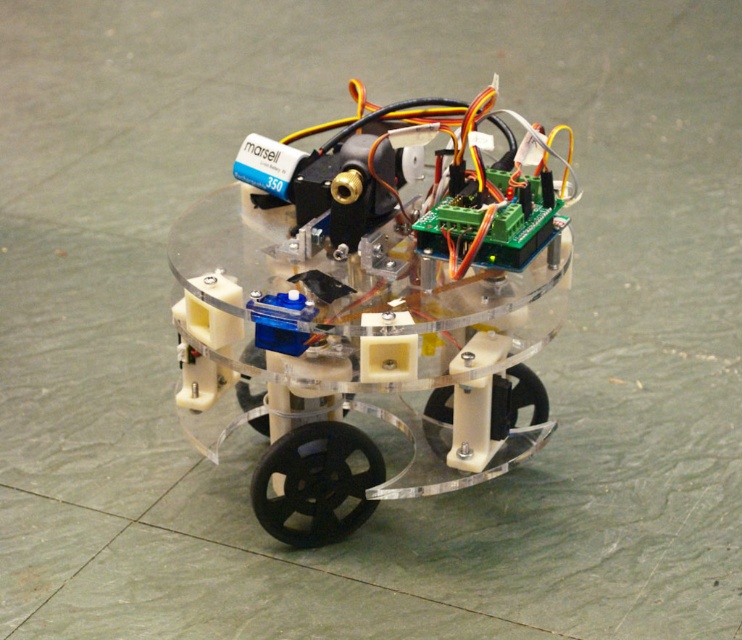
Does clear acrylic robot at center appear on the right side of black rubber wheel at center?

Indeed, clear acrylic robot at center is positioned on the right side of black rubber wheel at center.

Image resolution: width=742 pixels, height=640 pixels. Describe the element at coordinates (375, 304) in the screenshot. I see `clear acrylic robot at center` at that location.

Image resolution: width=742 pixels, height=640 pixels. What are the coordinates of `clear acrylic robot at center` in the screenshot? It's located at (375, 304).

Is black rubber wheel at center to the right of black plastic wheel at lower center from the viewer's perspective?

No, black rubber wheel at center is not to the right of black plastic wheel at lower center.

Based on the photo, does black rubber wheel at center appear over black plastic wheel at lower center?

Actually, black rubber wheel at center is below black plastic wheel at lower center.

Measure the distance between black rubber wheel at center and camera.

black rubber wheel at center is 1.08 meters from camera.

Locate an element on the screen. This screenshot has height=640, width=742. black rubber wheel at center is located at coordinates (315, 483).

Does clear acrylic robot at center have a greater width compared to black plastic wheel at lower center?

Indeed, clear acrylic robot at center has a greater width compared to black plastic wheel at lower center.

Does clear acrylic robot at center lie in front of black plastic wheel at lower center?

That is True.

Between point (370, 460) and point (536, 384), which one is positioned behind?

Positioned behind is point (536, 384).

Where is `clear acrylic robot at center`? This screenshot has width=742, height=640. clear acrylic robot at center is located at coordinates 375,304.